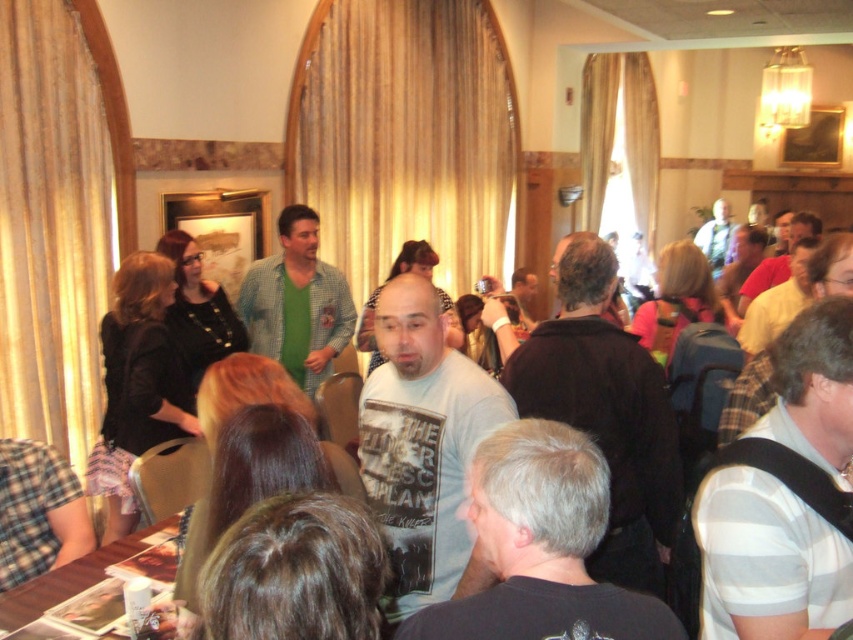
Question: Is wooden table at lower left wider than white t-shirt at center?

Choices:
 (A) yes
 (B) no

Answer: (B)

Question: Which of the following is the closest to the observer?

Choices:
 (A) white t-shirt at center
 (B) wooden table at lower left

Answer: (A)

Question: Is wooden table at lower left to the left of white t-shirt at center from the viewer's perspective?

Choices:
 (A) yes
 (B) no

Answer: (A)

Question: Which point appears farthest from the camera in this image?

Choices:
 (A) (138, 532)
 (B) (114, 557)

Answer: (A)

Question: Observing the image, what is the correct spatial positioning of wooden table at lower left in reference to white t-shirt at center?

Choices:
 (A) below
 (B) above

Answer: (B)